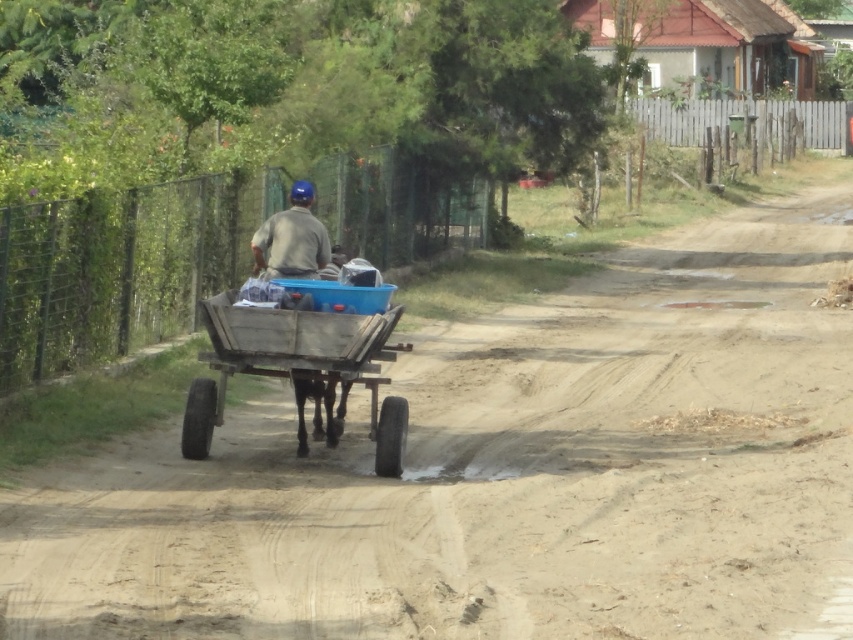
Question: Which point appears closest to the camera in this image?

Choices:
 (A) (62, 556)
 (B) (306, 268)

Answer: (A)

Question: Which object is closer to the camera taking this photo?

Choices:
 (A) brown sandy dirt track at center
 (B) matte blue helmet at center

Answer: (A)

Question: Is wooden wagon at center closer to camera compared to matte blue helmet at center?

Choices:
 (A) no
 (B) yes

Answer: (B)

Question: From the image, what is the correct spatial relationship of brown sandy dirt track at center in relation to wooden wagon at center?

Choices:
 (A) above
 (B) below

Answer: (B)

Question: Which point appears farthest from the camera in this image?

Choices:
 (A) (387, 628)
 (B) (318, 259)
 (C) (331, 317)

Answer: (B)

Question: Is brown sandy dirt track at center positioned before matte blue helmet at center?

Choices:
 (A) no
 (B) yes

Answer: (B)